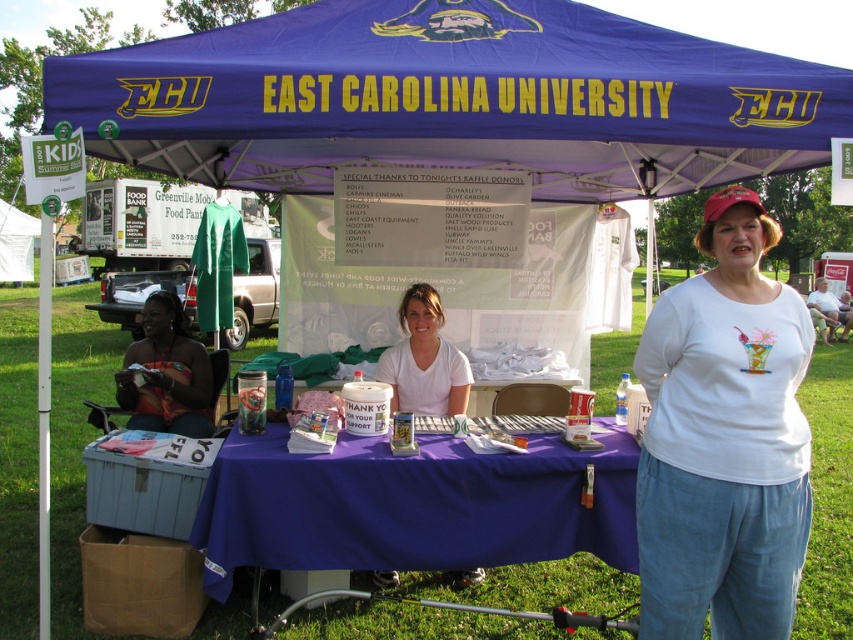
Who is shorter, white cotton t-shirt at center or matte orange dress at lower left?

matte orange dress at lower left is shorter.

What do you see at coordinates (724, 440) in the screenshot? This screenshot has width=853, height=640. I see `white cotton t-shirt at center` at bounding box center [724, 440].

Does point (677, 438) lie behind point (144, 337)?

No, it is not.

The image size is (853, 640). What are the coordinates of `white cotton t-shirt at center` in the screenshot? It's located at (724, 440).

Is purple fabric table at center taller than white matte shirt at center?

No.

Which of these two, purple fabric table at center or white matte shirt at center, stands taller?

Standing taller between the two is white matte shirt at center.

What do you see at coordinates (410, 506) in the screenshot?
I see `purple fabric table at center` at bounding box center [410, 506].

Locate an element on the screen. purple fabric table at center is located at coordinates [x=410, y=506].

Measure the distance between point (154, 397) and camera.

A distance of 4.56 meters exists between point (154, 397) and camera.

Is matte orange dress at lower left wider than white matte t-shirt at center?

No, matte orange dress at lower left is not wider than white matte t-shirt at center.

Between point (167, 390) and point (840, 314), which one is positioned in front?

Positioned in front is point (167, 390).

Where is `matte orange dress at lower left`? The width and height of the screenshot is (853, 640). matte orange dress at lower left is located at coordinates (166, 372).